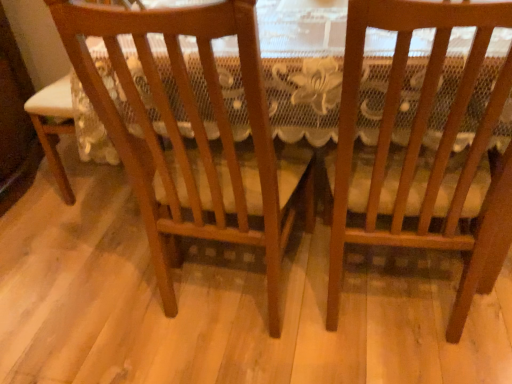
Question: In terms of width, does wooden chair at center, the 2th chair when ordered from left to right, look wider or thinner when compared to wooden chair at center, the first chair in the left-to-right sequence?

Choices:
 (A) thin
 (B) wide

Answer: (A)

Question: Is wooden chair at center, the 1th chair from the right, bigger or smaller than wooden chair at center, arranged as the 2th chair when viewed from the right?

Choices:
 (A) small
 (B) big

Answer: (A)

Question: Considering the positions of wooden chair at center, the 1th chair from the right, and wooden chair at center, the first chair in the left-to-right sequence, in the image, is wooden chair at center, the 1th chair from the right, taller or shorter than wooden chair at center, the first chair in the left-to-right sequence,?

Choices:
 (A) tall
 (B) short

Answer: (B)

Question: Is wooden chair at center, arranged as the 2th chair when viewed from the right, in front of or behind wooden chair at center, the 1th chair from the right, in the image?

Choices:
 (A) behind
 (B) front

Answer: (A)

Question: Is wooden chair at center, arranged as the 2th chair when viewed from the right, inside the boundaries of wooden chair at center, the 1th chair from the right, or outside?

Choices:
 (A) inside
 (B) outside

Answer: (B)

Question: Is wooden chair at center, the first chair in the left-to-right sequence, taller or shorter than wooden chair at center, the 2th chair when ordered from left to right?

Choices:
 (A) short
 (B) tall

Answer: (B)

Question: Considering the positions of wooden chair at center, the first chair in the left-to-right sequence, and wooden chair at center, the 2th chair when ordered from left to right, in the image, is wooden chair at center, the first chair in the left-to-right sequence, wider or thinner than wooden chair at center, the 2th chair when ordered from left to right,?

Choices:
 (A) wide
 (B) thin

Answer: (A)